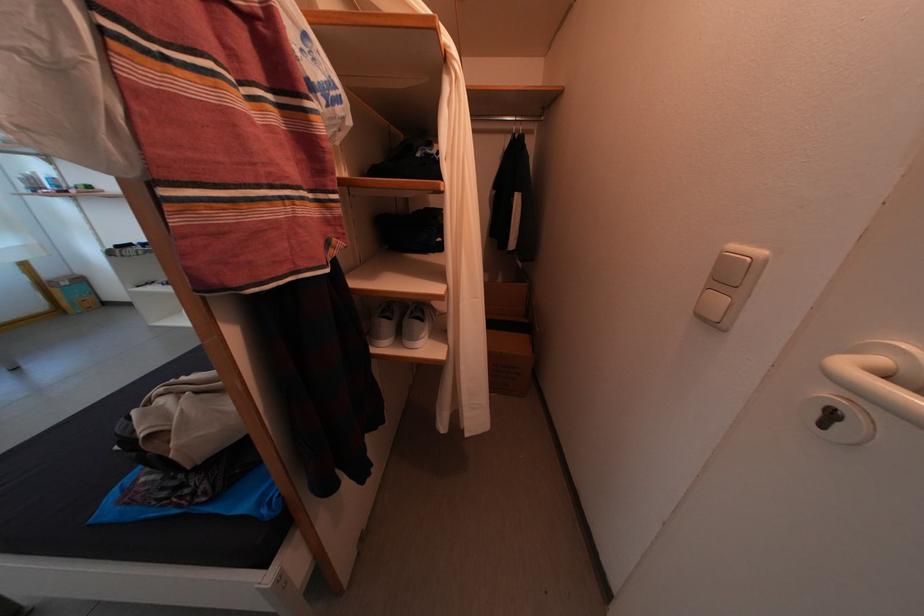
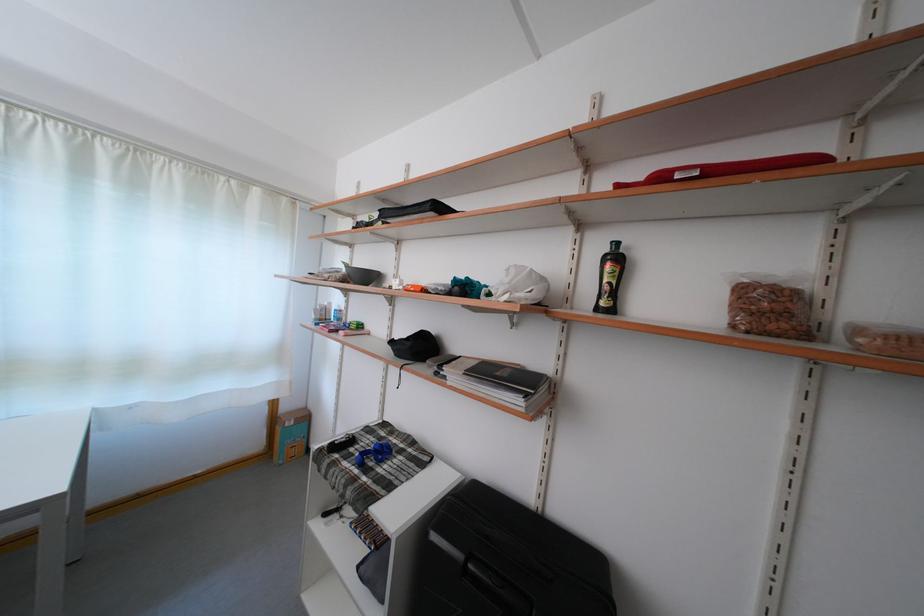
In the second image, find the point that corresponds to the point at 55,281 in the first image.

(293, 415)